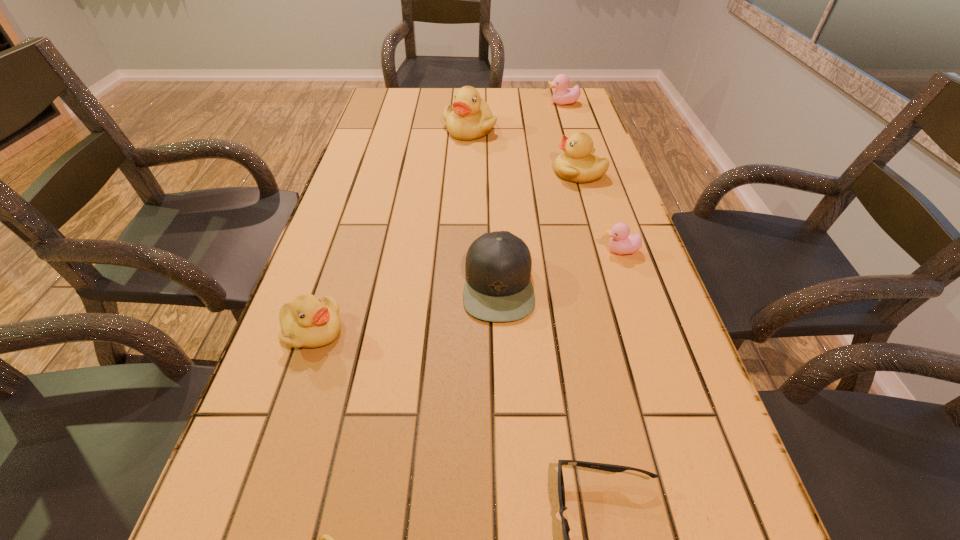
The height and width of the screenshot is (540, 960). Identify the location of the fourth farthest duckling. (621, 242).

Identify the location of vacant region located 0.310m on the front-facing side of the biggest yellow duckling. The height and width of the screenshot is (540, 960). (468, 198).

Find the location of a particular element. Image resolution: width=960 pixels, height=540 pixels. free space located 0.080m on the front-facing side of the third farthest object is located at coordinates tap(526, 173).

You are a GUI agent. You are given a task and a screenshot of the screen. Output one action in this format:
    pyautogui.click(x=<x>, y=<y>)
    Task: Click on the free point located 0.100m on the front-facing side of the third farthest object
    
    Given the screenshot: What is the action you would take?
    pyautogui.click(x=519, y=173)

Where is `vacant space situated on the front-facing side of the third farthest object`? The height and width of the screenshot is (540, 960). vacant space situated on the front-facing side of the third farthest object is located at coordinates (489, 173).

Where is `vacant region located 0.110m on the front-facing side of the bigger pink duckling`? Image resolution: width=960 pixels, height=540 pixels. vacant region located 0.110m on the front-facing side of the bigger pink duckling is located at coordinates (516, 104).

I want to click on free spot located 0.170m on the front-facing side of the bigger pink duckling, so click(500, 104).

The height and width of the screenshot is (540, 960). What are the coordinates of `vacant space situated on the front-facing side of the bigger pink duckling` in the screenshot? It's located at (495, 104).

I want to click on free space located on the brim of the cap, so click(327, 285).

You are a GUI agent. You are given a task and a screenshot of the screen. Output one action in this format:
    pyautogui.click(x=<x>, y=<y>)
    Task: Click on the free space located 0.070m on the brim of the cap
    The image size is (960, 540).
    Given the screenshot: What is the action you would take?
    pyautogui.click(x=432, y=285)